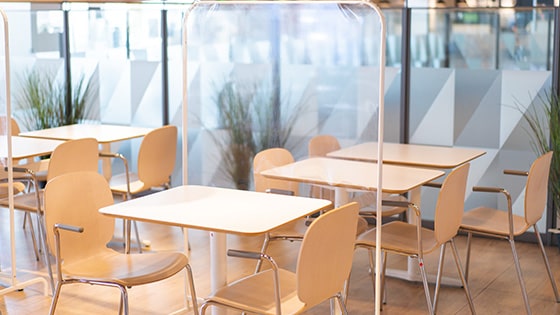
Find the location of `beige chair`. beige chair is located at coordinates (316, 258), (444, 208), (530, 185), (317, 139), (270, 158), (163, 144), (74, 199), (58, 152), (10, 124).